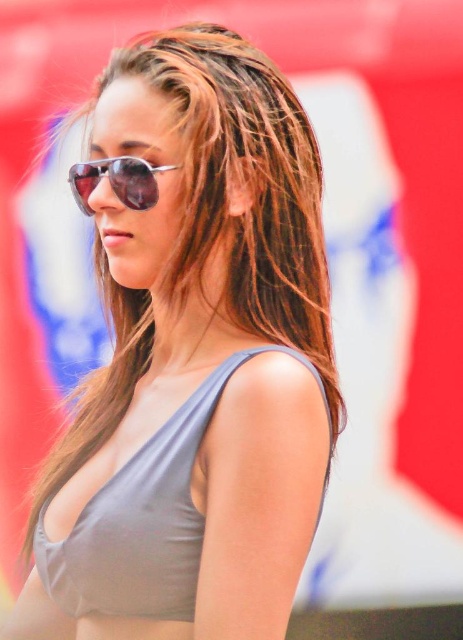
Question: Is the position of matte gray tank top at center more distant than that of matte gray belly at center?

Choices:
 (A) yes
 (B) no

Answer: (B)

Question: Considering the real-world distances, which object is farthest from the matte gray tank top at center?

Choices:
 (A) matte gray belly at center
 (B) matte gray bikini top at center

Answer: (A)

Question: Is matte gray tank top at center positioned in front of matte gray belly at center?

Choices:
 (A) yes
 (B) no

Answer: (A)

Question: Which of the following is the closest to the observer?

Choices:
 (A) matte gray bikini top at center
 (B) matte gray tank top at center
 (C) shiny metallic aviator sunglasses at center

Answer: (B)

Question: Is shiny metallic aviator sunglasses at center thinner than matte gray belly at center?

Choices:
 (A) no
 (B) yes

Answer: (A)

Question: Which point is farther to the camera?

Choices:
 (A) matte gray belly at center
 (B) shiny metallic aviator sunglasses at center
 (C) matte gray bikini top at center
 (D) matte gray tank top at center

Answer: (B)